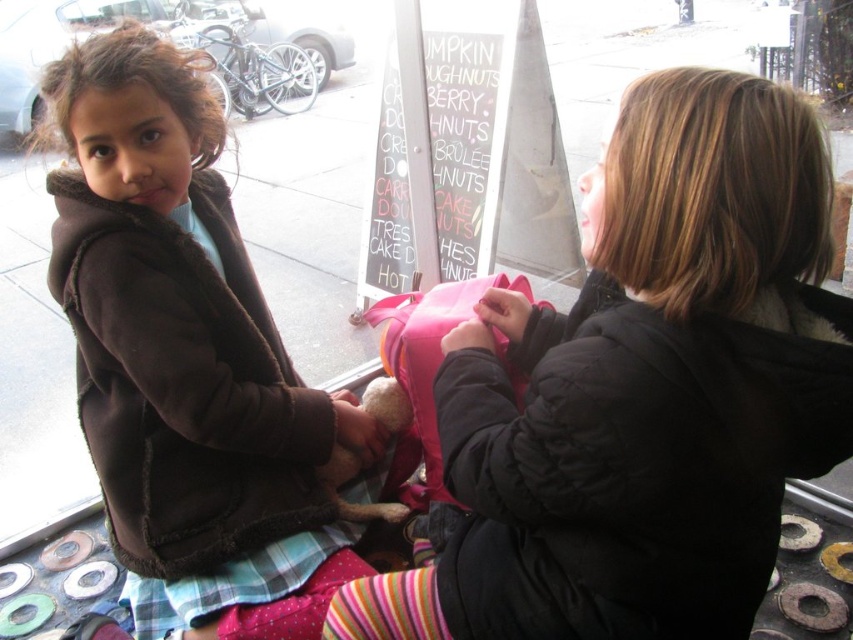
You are a delivery person who needs to place a package on the bench where the matte pink backpack at center and the striped cotton sock at lower center are located. Can you place the package between them without moving either item?

The matte pink backpack at center is in front of the striped cotton sock at lower center, so there is space between them where the package can be placed without moving either item.

You are helping a child find their backpack and jacket. The child says they remember seeing a matte pink backpack at center and a brown fuzzy jacket at left. Based on the scene, can you tell which item is closer to the right side of the bench?

The matte pink backpack at center is positioned on the right side of brown fuzzy jacket at left, so the matte pink backpack at center is closer to the right side of the bench.

You are a photographer setting up for a group photo. You need to ensure that all subjects are visible in the frame. Given the brown fuzzy jacket at left and the striped cotton sock at lower center, which item should you focus on to ensure both are in focus?

The brown fuzzy jacket at left is wider than the striped cotton sock at lower center, so focusing on the brown fuzzy jacket at left will ensure both are in focus as it has a larger size and occupies more space in the frame.